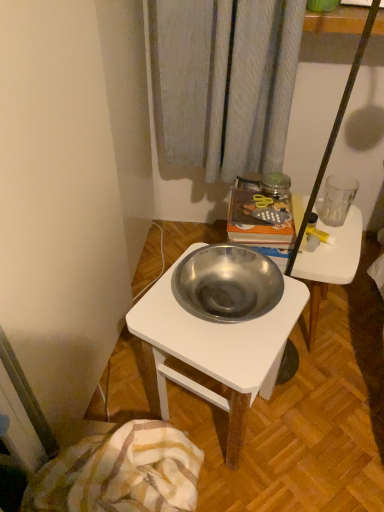
You are a GUI agent. You are given a task and a screenshot of the screen. Output one action in this format:
    pyautogui.click(x=<x>, y=<y>)
    Task: Click on the vacant space in metallic white desk at center (from a real-world perspective)
    
    Given the screenshot: What is the action you would take?
    pyautogui.click(x=217, y=426)